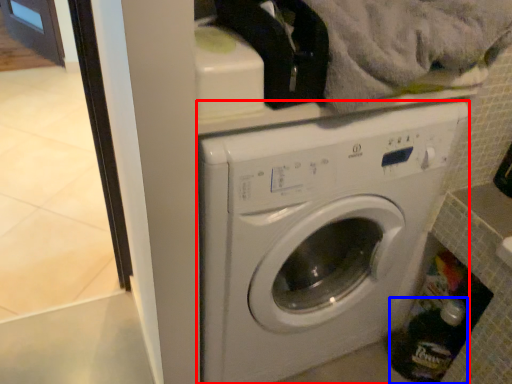
Question: Which point is closer to the camera, washing machine (highlighted by a red box) or bottle (highlighted by a blue box)?

Choices:
 (A) washing machine
 (B) bottle

Answer: (A)